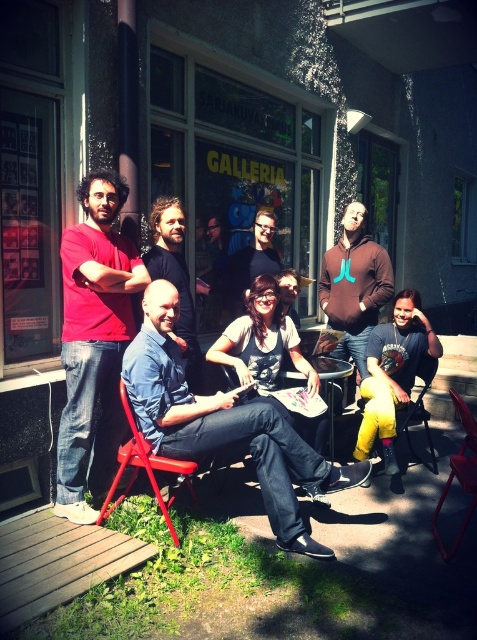
Does point (408, 323) lie in front of point (241, 310)?

Yes, point (408, 323) is in front of point (241, 310).

Locate an element on the screen. The image size is (477, 640). denim jeans at lower right is located at coordinates (393, 376).

This screenshot has width=477, height=640. Describe the element at coordinates (387, 412) in the screenshot. I see `yellow fabric chair at lower right` at that location.

Between yellow fabric chair at lower right and matte black shirt at center, which one has less height?

Standing shorter between the two is yellow fabric chair at lower right.

What do you see at coordinates (387, 412) in the screenshot? The height and width of the screenshot is (640, 477). I see `yellow fabric chair at lower right` at bounding box center [387, 412].

The image size is (477, 640). What are the coordinates of `yellow fabric chair at lower right` in the screenshot? It's located at (387, 412).

Is wooden deck at lower left shorter than metallic red folding chair at center?

Correct, wooden deck at lower left is not as tall as metallic red folding chair at center.

From the picture: Is wooden deck at lower left bigger than metallic red folding chair at center?

Yes.

The height and width of the screenshot is (640, 477). I want to click on wooden deck at lower left, so click(283, 570).